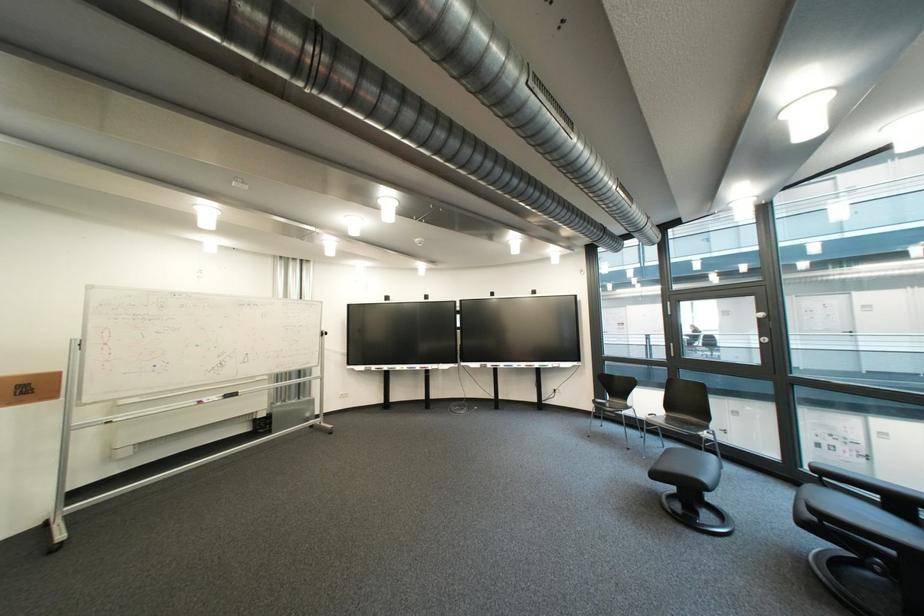
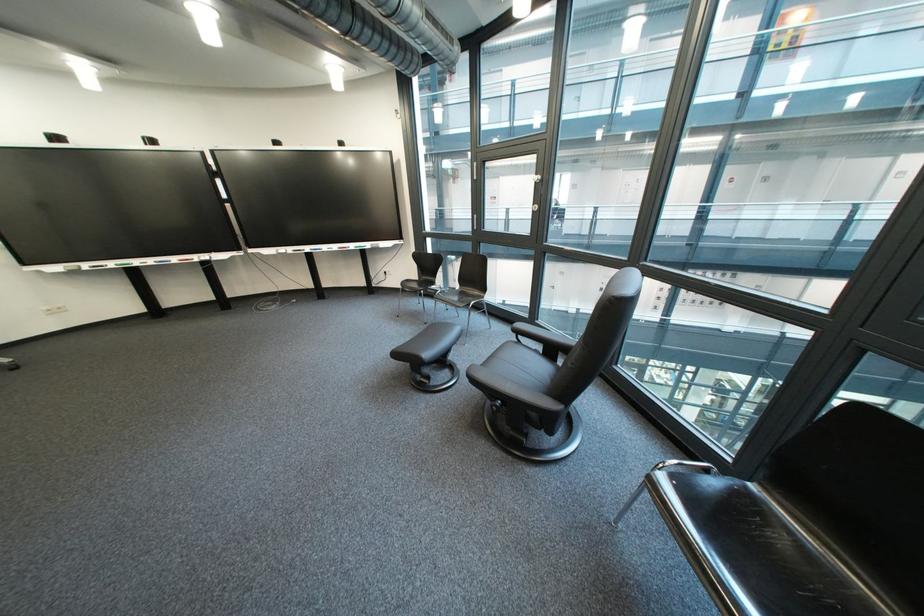
Where in the second image is the point corresponding to point 420,370 from the first image?

(169, 264)